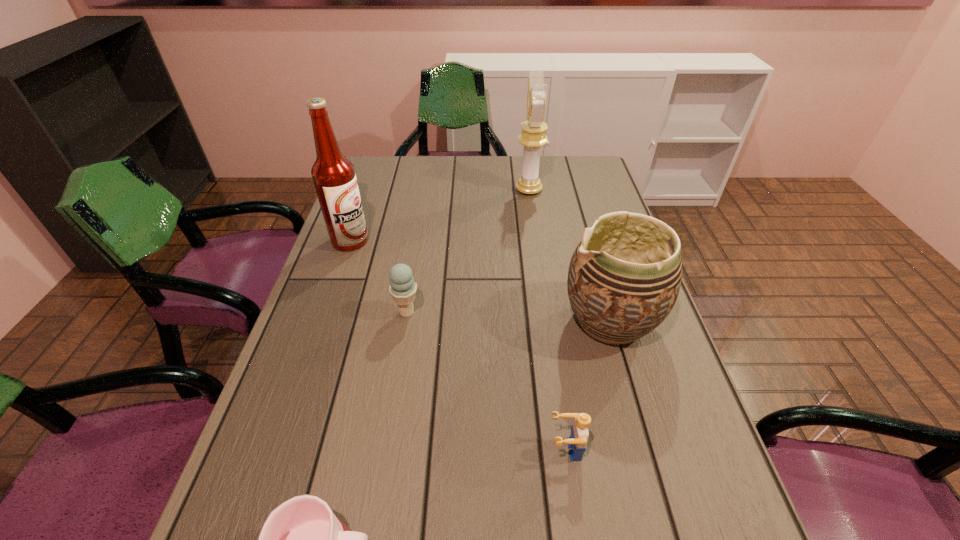
This screenshot has width=960, height=540. Identify the location of free location located 0.280m on the front of the fourth shortest object. (660, 495).

I want to click on free spot located on the front of the third shortest object, so click(x=386, y=438).

At what (x,y) coordinates should I click in order to perform the action: click on vacant region located on the face of the fifth farthest object. Please return your answer as a coordinate pair (x, y). Looking at the image, I should click on 409,449.

Where is `vacant space situated on the face of the fifth farthest object`? The image size is (960, 540). vacant space situated on the face of the fifth farthest object is located at coordinates (468, 449).

Locate an element on the screen. The width and height of the screenshot is (960, 540). blank space located 0.210m on the face of the fifth farthest object is located at coordinates (436, 449).

This screenshot has width=960, height=540. What are the coordinates of `object that is at the far edge` in the screenshot? It's located at (533, 137).

At what (x,y) coordinates should I click in order to perform the action: click on object situated at the left edge. Please return your answer as a coordinate pair (x, y). The image size is (960, 540). Looking at the image, I should click on (334, 177).

Where is `object that is positioned at the right edge`? The height and width of the screenshot is (540, 960). object that is positioned at the right edge is located at coordinates (622, 283).

At what (x,y) coordinates should I click in order to perform the action: click on vacant region at the far edge of the desktop. Please return your answer as a coordinate pair (x, y). The image size is (960, 540). Looking at the image, I should click on (422, 178).

Identify the location of free point at the left edge. (252, 491).